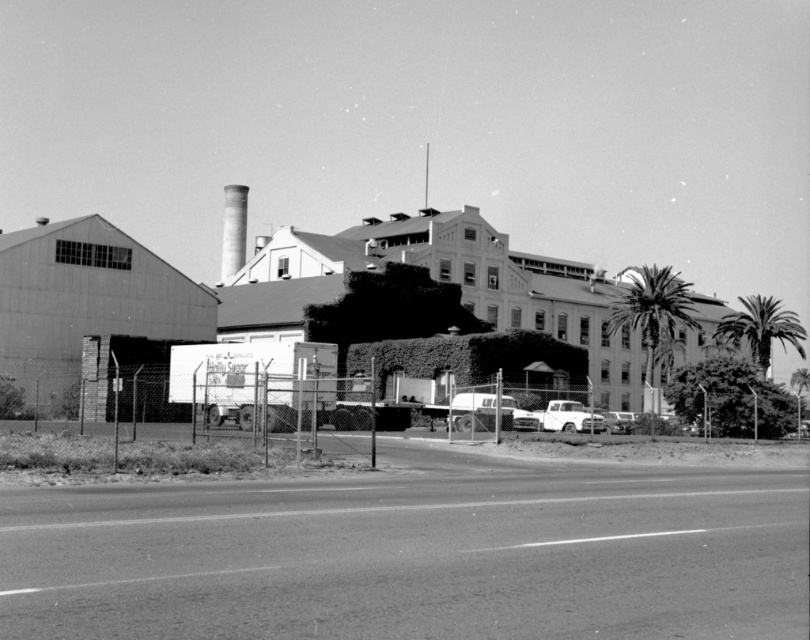
Can you confirm if dark green leafy palm tree at right is wider than shiny silver sedan at center?

Yes, dark green leafy palm tree at right is wider than shiny silver sedan at center.

Which is above, dark green leafy palm tree at right or shiny silver sedan at center?

dark green leafy palm tree at right

Who is more distant from viewer, (757, 310) or (484, 410)?

Point (757, 310)

Find the location of a particular element. This screenshot has width=810, height=640. dark green leafy palm tree at right is located at coordinates (761, 328).

Can you confirm if green leafy palm tree at center-right is positioned to the right of smooth white chimney at center?

Indeed, green leafy palm tree at center-right is positioned on the right side of smooth white chimney at center.

Is green leafy palm tree at center-right positioned in front of smooth white chimney at center?

That is True.

Which is behind, point (653, 320) or point (237, 237)?

Positioned behind is point (237, 237).

Identify the location of green leafy palm tree at center-right. This screenshot has width=810, height=640. (653, 308).

Does shiny silver sedan at center lie in front of shiny chrome pickup truck at center?

No, it is not.

Between shiny silver sedan at center and shiny chrome pickup truck at center, which one appears on the left side from the viewer's perspective?

shiny silver sedan at center is more to the left.

Which is behind, point (463, 406) or point (578, 412)?

Point (578, 412)

This screenshot has width=810, height=640. Identify the location of shiny silver sedan at center. (471, 408).